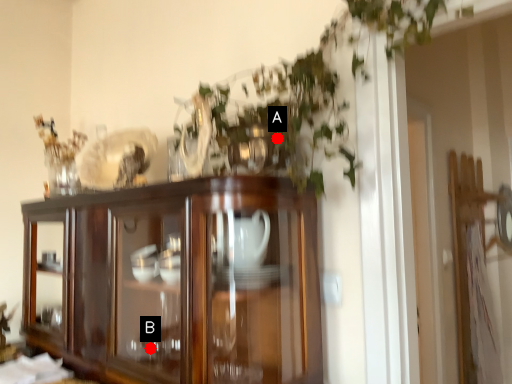
Question: Two points are circled on the image, labeled by A and B beside each circle. Which point is further to the camera?

Choices:
 (A) A is further
 (B) B is further

Answer: (B)